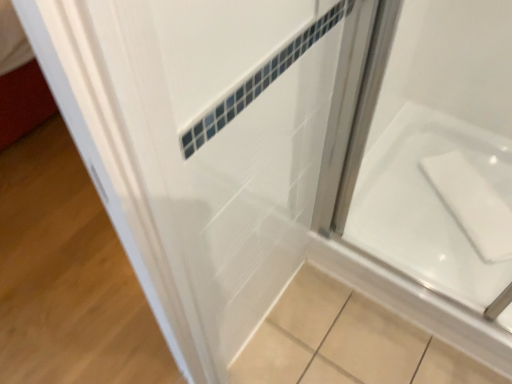
What is the approximate height of white glossy door at upper left?

white glossy door at upper left is 2.29 inches tall.

Where is `white glossy door at upper left`? The width and height of the screenshot is (512, 384). white glossy door at upper left is located at coordinates (208, 144).

What do you see at coordinates (208, 144) in the screenshot?
I see `white glossy door at upper left` at bounding box center [208, 144].

The width and height of the screenshot is (512, 384). What do you see at coordinates (428, 204) in the screenshot?
I see `white glossy bath at lower right` at bounding box center [428, 204].

Identify the location of white glossy bath at lower right. This screenshot has width=512, height=384. (428, 204).

The height and width of the screenshot is (384, 512). I want to click on white glossy door at upper left, so click(208, 144).

Is white glossy door at upper left at the right side of white glossy bath at lower right?

In fact, white glossy door at upper left is to the left of white glossy bath at lower right.

Is white glossy door at upper left in front of or behind white glossy bath at lower right in the image?

Clearly, white glossy door at upper left is in front of white glossy bath at lower right.

Which point is more distant from viewer, (55, 51) or (469, 289)?

The point (469, 289) is farther from the camera.

From the image's perspective, which is above, white glossy door at upper left or white glossy bath at lower right?

white glossy bath at lower right is shown above in the image.

From a real-world perspective, between white glossy door at upper left and white glossy bath at lower right, who is vertically higher?

From a 3D spatial view, white glossy bath at lower right is above.

Which of these two, white glossy door at upper left or white glossy bath at lower right, is thinner?

Thinner between the two is white glossy bath at lower right.

Looking at this image, which of these two, white glossy door at upper left or white glossy bath at lower right, stands taller?

white glossy bath at lower right is taller.

Which of these two, white glossy door at upper left or white glossy bath at lower right, is smaller?

white glossy door at upper left is smaller.

Does white glossy door at upper left contain white glossy bath at lower right?

That's incorrect, white glossy bath at lower right is not inside white glossy door at upper left.

Would you consider white glossy door at upper left to be distant from white glossy bath at lower right?

No, white glossy door at upper left is not far from white glossy bath at lower right.

Could you tell me if white glossy door at upper left is facing white glossy bath at lower right?

No, white glossy door at upper left is not oriented towards white glossy bath at lower right.

Where is `bath that is above the white glossy door at upper left (from the image's perspective)`? The image size is (512, 384). bath that is above the white glossy door at upper left (from the image's perspective) is located at coordinates (428, 204).

Considering the relative positions of white glossy bath at lower right and white glossy door at upper left in the image provided, is white glossy bath at lower right to the left of white glossy door at upper left from the viewer's perspective?

In fact, white glossy bath at lower right is to the right of white glossy door at upper left.

Relative to white glossy door at upper left, is white glossy bath at lower right in front or behind?

In the image, white glossy bath at lower right appears behind white glossy door at upper left.

Which is closer, (437, 186) or (134, 98)?

Positioned in front is point (134, 98).

From the image's perspective, is white glossy bath at lower right above or below white glossy door at upper left?

Based on their image positions, white glossy bath at lower right is located above white glossy door at upper left.

From a real-world perspective, who is located higher, white glossy bath at lower right or white glossy door at upper left?

white glossy bath at lower right.

Considering the sizes of objects white glossy bath at lower right and white glossy door at upper left in the image provided, who is thinner, white glossy bath at lower right or white glossy door at upper left?

white glossy bath at lower right.

Which of these two, white glossy bath at lower right or white glossy door at upper left, stands shorter?

white glossy door at upper left is shorter.

Which of these two, white glossy bath at lower right or white glossy door at upper left, is smaller?

With smaller size is white glossy door at upper left.

Which is correct: white glossy bath at lower right is inside white glossy door at upper left, or outside of it?

white glossy bath at lower right cannot be found inside white glossy door at upper left.

Would you consider white glossy bath at lower right to be distant from white glossy door at upper left?

No.

Is white glossy bath at lower right facing towards white glossy door at upper left?

No.

The width and height of the screenshot is (512, 384). I want to click on bath that appears on the right of white glossy door at upper left, so pos(428,204).

You are a GUI agent. You are given a task and a screenshot of the screen. Output one action in this format:
    pyautogui.click(x=<x>, y=<y>)
    Task: Click on the door lying in front of the white glossy bath at lower right
    This screenshot has height=384, width=512.
    Given the screenshot: What is the action you would take?
    pyautogui.click(x=208, y=144)

The width and height of the screenshot is (512, 384). I want to click on door that appears on the left of white glossy bath at lower right, so click(208, 144).